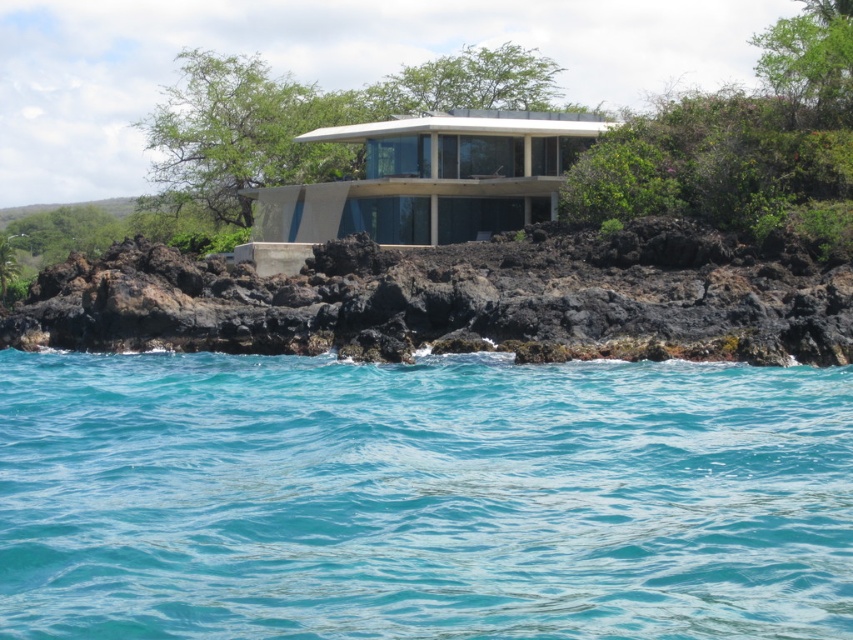
Between clear blue water at center and black volcanic rock at center, which one is positioned higher?

black volcanic rock at center

Does clear blue water at center have a lesser width compared to black volcanic rock at center?

Yes.

Is point (682, 406) positioned behind point (109, 296)?

No, it is in front of (109, 296).

Where is `clear blue water at center`? clear blue water at center is located at coordinates (421, 497).